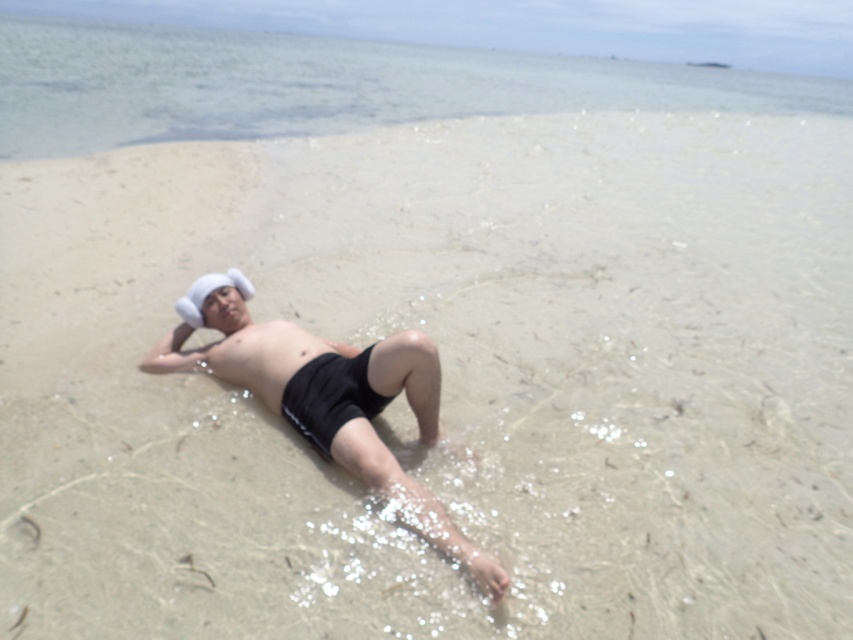
Between smooth skin stomach at center and white fabric baseball hat at upper center, which one appears on the left side from the viewer's perspective?

From the viewer's perspective, white fabric baseball hat at upper center appears more on the left side.

Is point (227, 337) positioned behind point (231, 280)?

That is False.

Identify the location of smooth skin stomach at center. (262, 355).

Is matte black shorts at center to the left of smooth skin stomach at center from the viewer's perspective?

No, matte black shorts at center is not to the left of smooth skin stomach at center.

Is point (189, 324) positioned after point (206, 312)?

Yes, point (189, 324) is behind point (206, 312).

The image size is (853, 640). What are the coordinates of `matte black shorts at center` in the screenshot? It's located at (334, 401).

You are a GUI agent. You are given a task and a screenshot of the screen. Output one action in this format:
    pyautogui.click(x=<x>, y=<y>)
    Task: Click on the matte black shorts at center
    Image resolution: width=853 pixels, height=640 pixels.
    Given the screenshot: What is the action you would take?
    pyautogui.click(x=334, y=401)

From the picture: Can you confirm if clear water at upper center is positioned to the right of smooth skin stomach at center?

Correct, you'll find clear water at upper center to the right of smooth skin stomach at center.

Where is `clear water at upper center`? This screenshot has width=853, height=640. clear water at upper center is located at coordinates (323, 84).

The height and width of the screenshot is (640, 853). In order to click on clear water at upper center in this screenshot , I will do `click(323, 84)`.